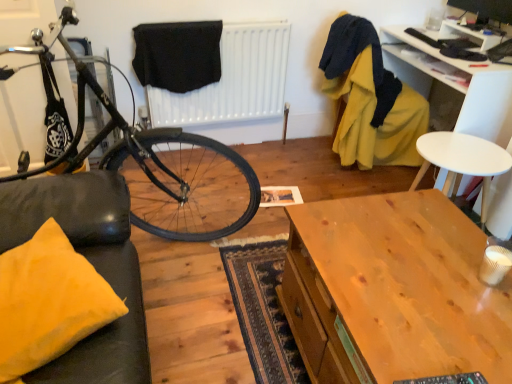
This screenshot has height=384, width=512. What are the coordinates of `blank space above wooden desk at center, which is the 2th desk in right-to-left order (from a real-world perspective)` in the screenshot? It's located at (419, 299).